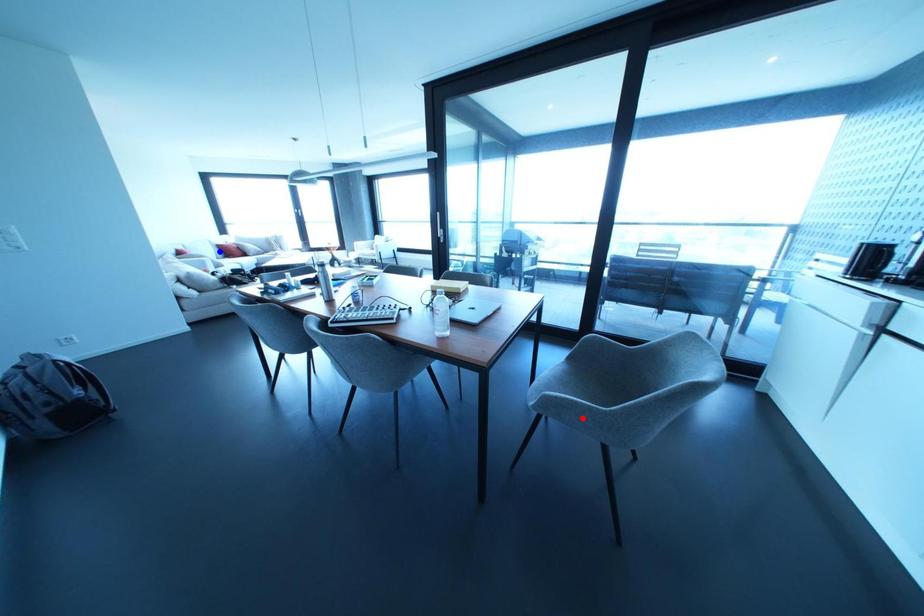
Question: In the image, two points are highlighted. Which point is nearer to the camera? Reply with the corresponding letter.

Choices:
 (A) blue point
 (B) red point

Answer: (B)